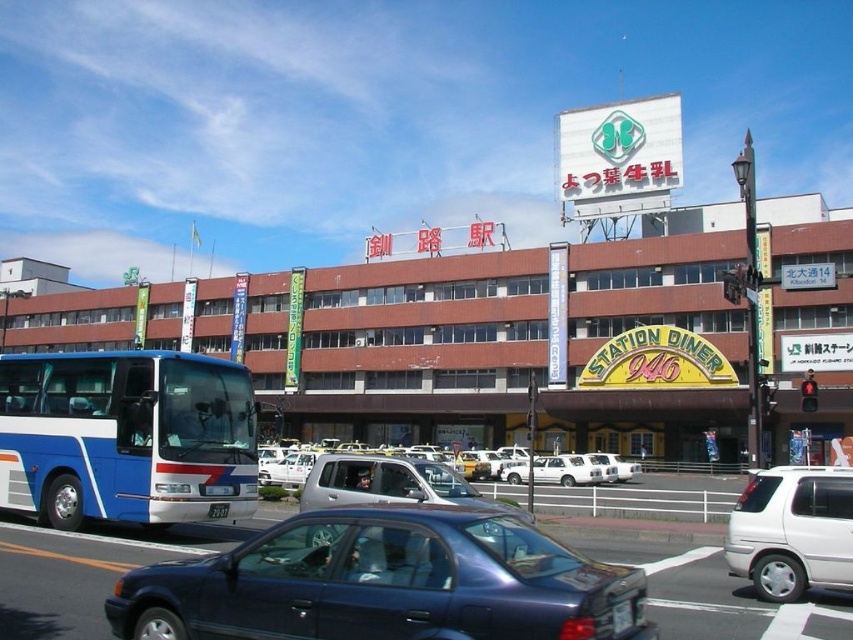
Question: Considering the real-world distances, which object is farthest from the metallic blue sedan at center?

Choices:
 (A) white matte sedan at center
 (B) black plastic license plate at center

Answer: (A)

Question: Which point is closer to the camera?

Choices:
 (A) black plastic license plate at center
 (B) metallic blue sedan at center

Answer: (B)

Question: In this image, where is white matte van at lower right located relative to white plastic license plate at center?

Choices:
 (A) above
 (B) below

Answer: (B)

Question: Which point is closer to the camera taking this photo?

Choices:
 (A) (219, 508)
 (B) (810, 548)

Answer: (B)

Question: From the image, what is the correct spatial relationship of metallic blue sedan at center in relation to white plastic license plate at center?

Choices:
 (A) below
 (B) above

Answer: (A)

Question: Can you confirm if white matte sedan at center is positioned below white plastic license plate at center?

Choices:
 (A) no
 (B) yes

Answer: (B)